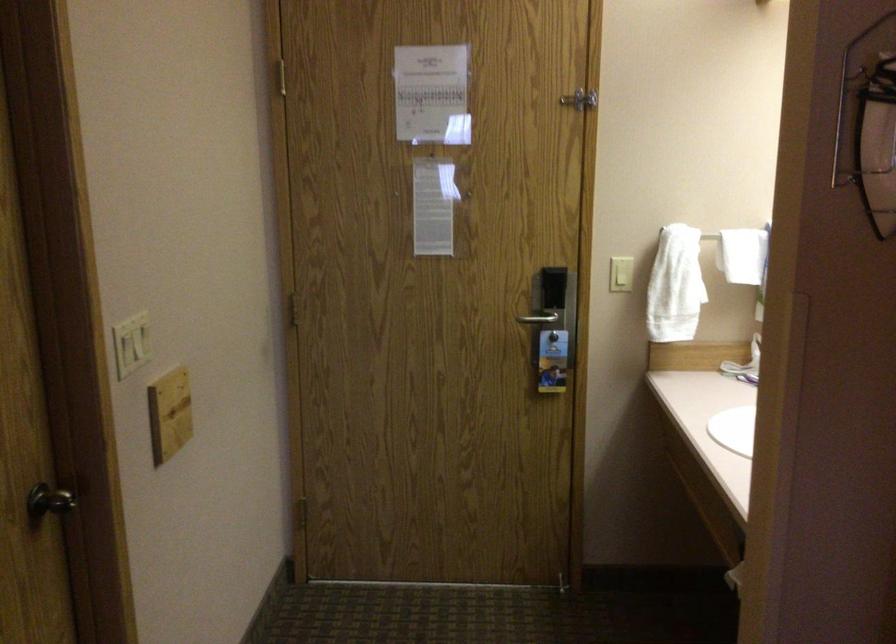
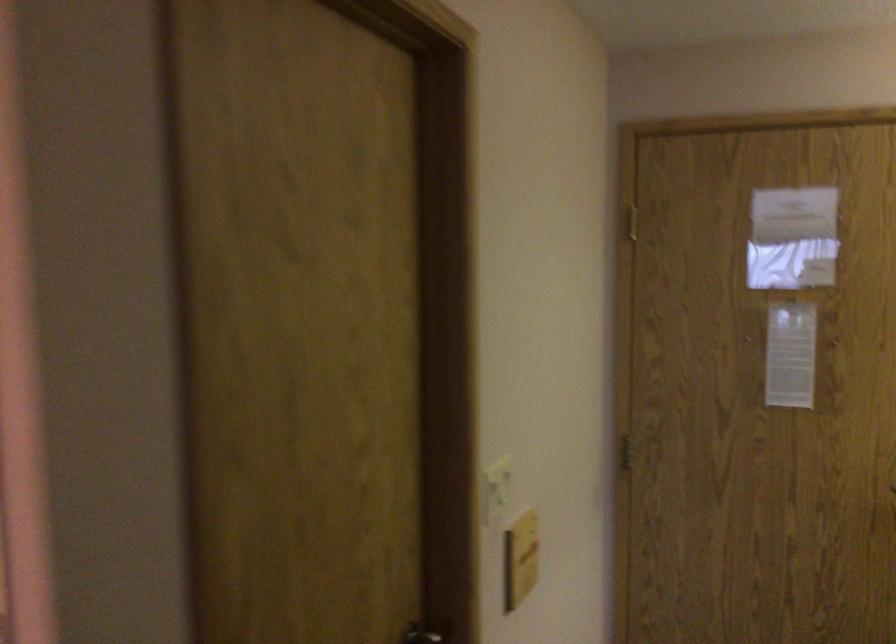
Question: The first image is from the beginning of the video and the second image is from the end. How did the camera likely rotate when shooting the video?

Choices:
 (A) Left
 (B) Right
 (C) Up
 (D) Down

Answer: (A)